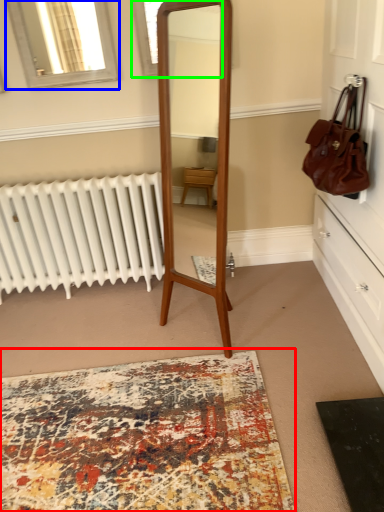
Question: Which is nearer to the mat (highlighted by a red box)? window (highlighted by a blue box) or window (highlighted by a green box).

Choices:
 (A) window
 (B) window

Answer: (A)